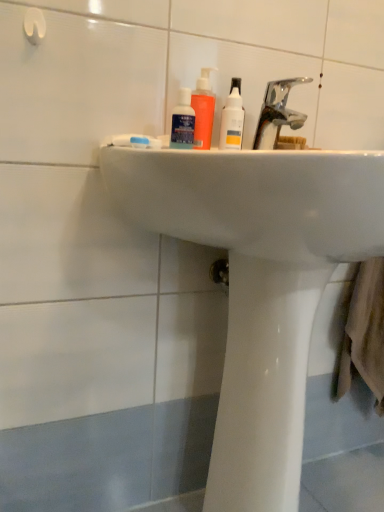
Question: Does white glossy sink at center appear on the left side of blue matte toothpaste at center?

Choices:
 (A) no
 (B) yes

Answer: (A)

Question: Is white glossy sink at center outside blue matte toothpaste at center?

Choices:
 (A) yes
 (B) no

Answer: (A)

Question: Does white glossy sink at center have a larger size compared to blue matte toothpaste at center?

Choices:
 (A) no
 (B) yes

Answer: (B)

Question: Does white glossy sink at center have a lesser width compared to blue matte toothpaste at center?

Choices:
 (A) no
 (B) yes

Answer: (A)

Question: From the image's perspective, is white glossy sink at center below blue matte toothpaste at center?

Choices:
 (A) yes
 (B) no

Answer: (A)

Question: From a real-world perspective, is white glossy sink at center below blue matte toothpaste at center?

Choices:
 (A) no
 (B) yes

Answer: (B)

Question: From a real-world perspective, does blue matte toothpaste at center sit lower than white glossy sink at center?

Choices:
 (A) no
 (B) yes

Answer: (A)

Question: Does blue matte toothpaste at center appear on the left side of white glossy sink at center?

Choices:
 (A) no
 (B) yes

Answer: (B)

Question: Considering the relative sizes of blue matte toothpaste at center and white glossy sink at center in the image provided, is blue matte toothpaste at center shorter than white glossy sink at center?

Choices:
 (A) no
 (B) yes

Answer: (B)

Question: From a real-world perspective, is blue matte toothpaste at center on white glossy sink at center?

Choices:
 (A) yes
 (B) no

Answer: (A)

Question: Considering the relative sizes of blue matte toothpaste at center and white glossy sink at center in the image provided, is blue matte toothpaste at center taller than white glossy sink at center?

Choices:
 (A) no
 (B) yes

Answer: (A)

Question: Can you confirm if blue matte toothpaste at center is wider than white glossy sink at center?

Choices:
 (A) no
 (B) yes

Answer: (A)

Question: From the image's perspective, would you say white glossy bottle at upper center is shown under blue matte toothpaste at center?

Choices:
 (A) no
 (B) yes

Answer: (A)